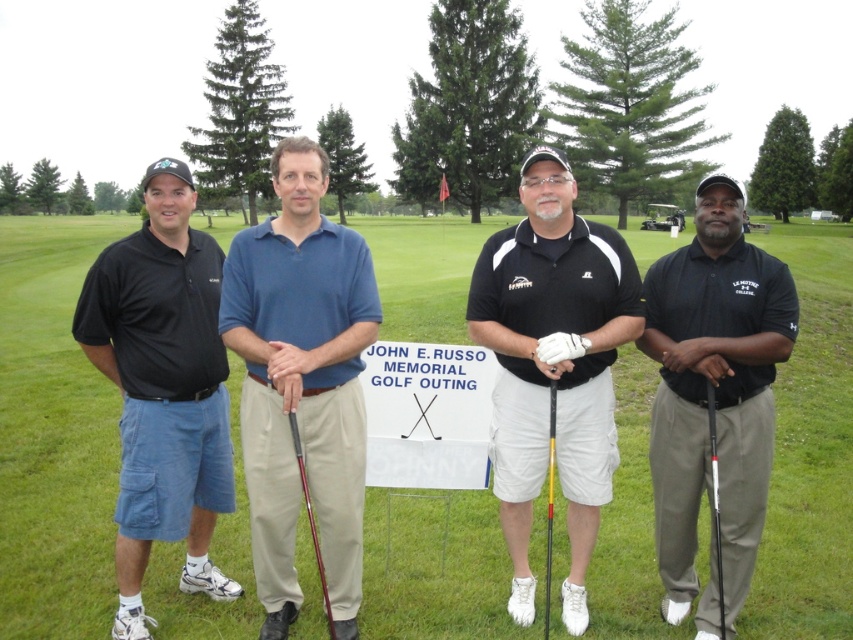
You are a golf cart driver who needs to place two golf clubs, the black matte golf club at right and the yellow matte golf club at center, into a storage compartment that can only hold items within 30 inches in length. Can both clubs fit side by side without overlapping?

The black matte golf club at right and yellow matte golf club at center are 32.70 inches apart from each other. Since the storage compartment can only hold items within 30 inches, the two clubs cannot fit side by side without overlapping.

You are a golfer who wants to choose a golf club to hit a long distance shot. Which club should you choose between the black matte golf club at right and the yellow matte golf club at center?

The black matte golf club at right is larger in size than the yellow matte golf club at center, so you should choose the black matte golf club at right for a long distance shot.